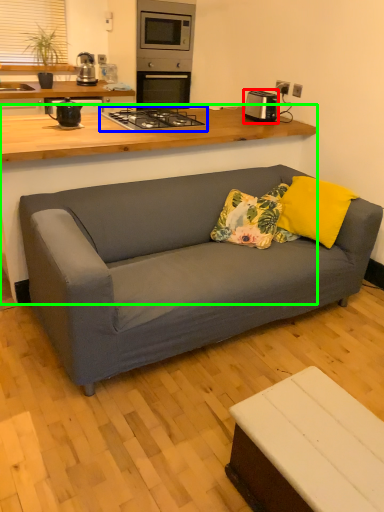
Question: Which object is the closest to the appliance (highlighted by a red box)? Choose among these: gas stove (highlighted by a blue box) or table (highlighted by a green box).

Choices:
 (A) gas stove
 (B) table

Answer: (A)